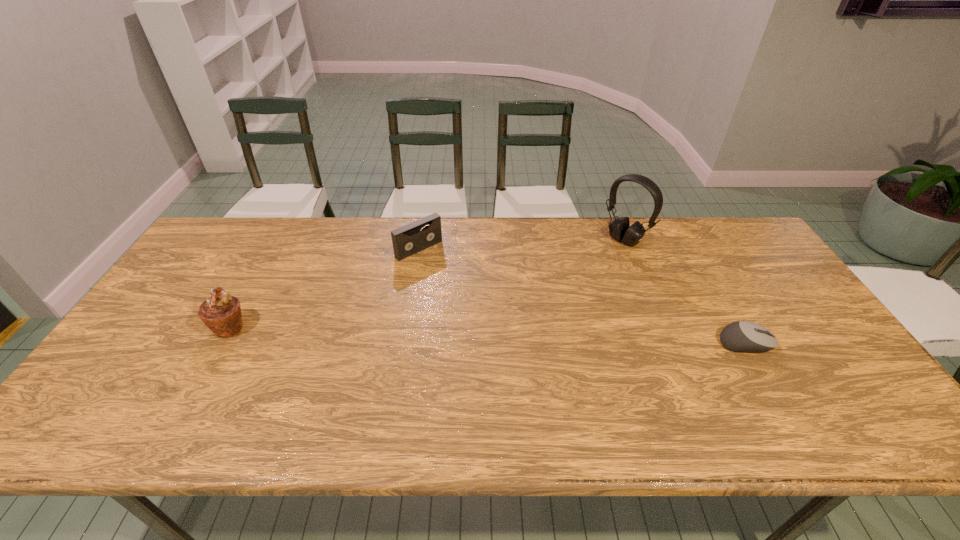
Locate an element on the screen. blank space that satisfies the following two spatial constraints: 1. on the front side of the computer equipment; 2. on the wheel side of the videotape is located at coordinates (403, 343).

At what (x,y) coordinates should I click in order to perform the action: click on vacant space that satisfies the following two spatial constraints: 1. on the front side of the rightmost object; 2. on the wheel side of the muffin. Please return your answer as a coordinate pair (x, y). The width and height of the screenshot is (960, 540). Looking at the image, I should click on (221, 343).

The image size is (960, 540). In order to click on free region that satisfies the following two spatial constraints: 1. on the front side of the muffin; 2. on the wheel side of the shortest object in this screenshot , I will do `click(221, 343)`.

What are the coordinates of `vacant area that satisfies the following two spatial constraints: 1. on the back side of the muffin; 2. on the left side of the second object from left to right` in the screenshot? It's located at (274, 249).

The width and height of the screenshot is (960, 540). Identify the location of vacant region that satisfies the following two spatial constraints: 1. on the back side of the headset; 2. on the right side of the second object from left to right. (420, 240).